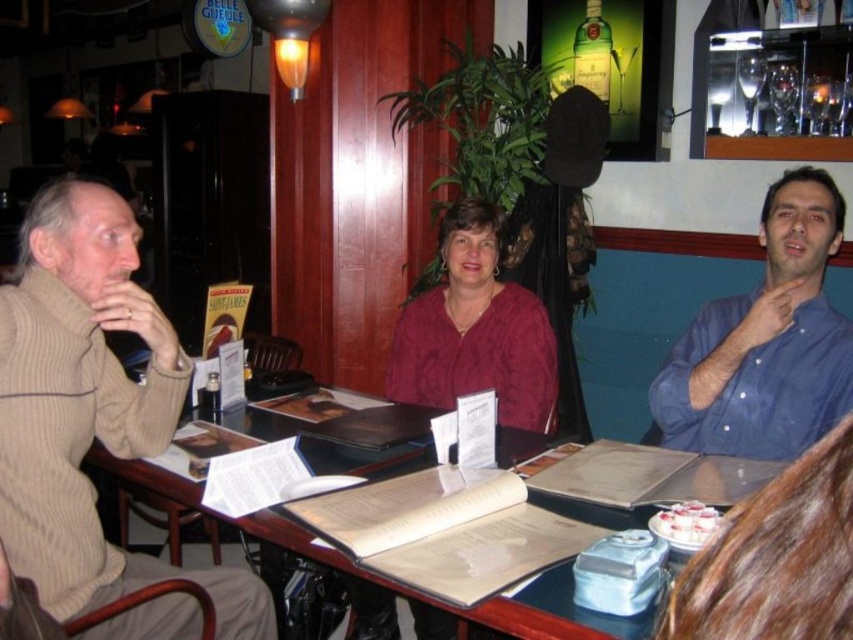
You are a waiter trying to place a new drink order on the table. Considering the beige ribbed sweater at left and the wooden table at center, which object has enough space to accommodate the drink without spilling?

The wooden table at center has a greater width than the beige ribbed sweater at left, so placing the drink there would provide sufficient space to avoid spilling.